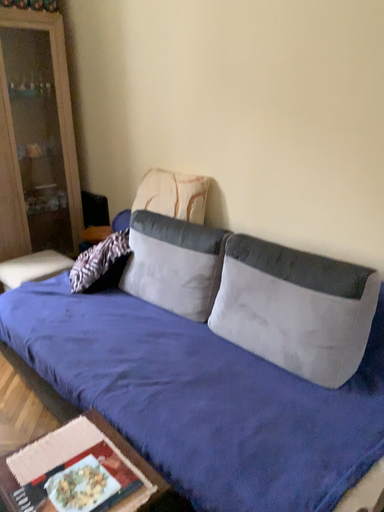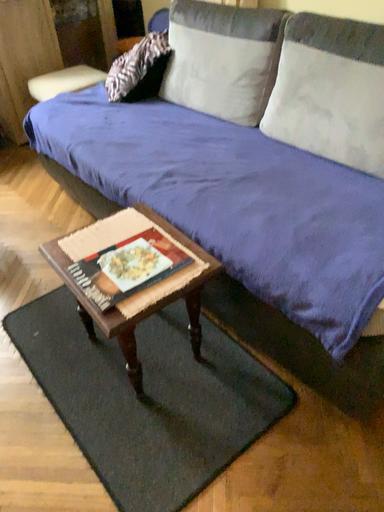
Question: Which way did the camera rotate in the video?

Choices:
 (A) rotated downward
 (B) rotated upward

Answer: (A)